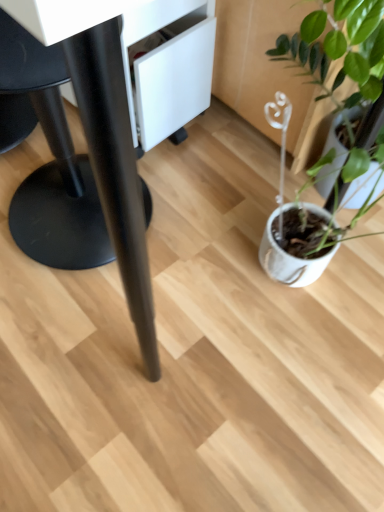
Question: Relative to black matte swivel chair at left, is white matte pot at right in front or behind?

Choices:
 (A) behind
 (B) front

Answer: (A)

Question: From the image's perspective, is white matte pot at right above or below black matte swivel chair at left?

Choices:
 (A) above
 (B) below

Answer: (B)

Question: Estimate the real-world distances between objects in this image. Which object is closer to the black matte swivel chair at left?

Choices:
 (A) white matte pot at right
 (B) black matte table at center

Answer: (B)

Question: Which is nearer to the black matte swivel chair at left?

Choices:
 (A) white matte pot at right
 (B) black matte table at center

Answer: (B)